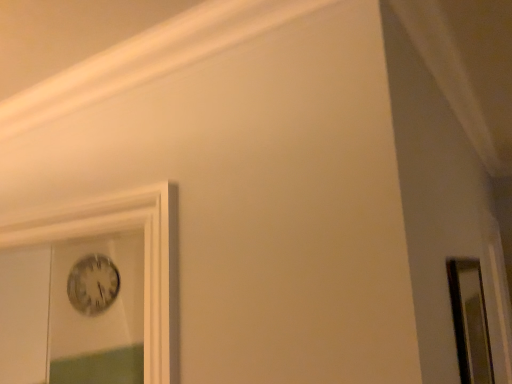
Question: From the image's perspective, relative to metallic silver clock at upper left, is clear glass mirror at right above or below?

Choices:
 (A) below
 (B) above

Answer: (B)

Question: Is clear glass mirror at right inside or outside of metallic silver clock at upper left?

Choices:
 (A) inside
 (B) outside

Answer: (B)

Question: In the image, is clear glass mirror at right positioned in front of or behind metallic silver clock at upper left?

Choices:
 (A) front
 (B) behind

Answer: (A)

Question: Considering the relative positions of metallic silver clock at upper left and clear glass mirror at right in the image provided, is metallic silver clock at upper left to the left or to the right of clear glass mirror at right?

Choices:
 (A) left
 (B) right

Answer: (A)

Question: Considering the positions of metallic silver clock at upper left and clear glass mirror at right in the image, is metallic silver clock at upper left wider or thinner than clear glass mirror at right?

Choices:
 (A) wide
 (B) thin

Answer: (B)

Question: From the image's perspective, is metallic silver clock at upper left located above or below clear glass mirror at right?

Choices:
 (A) above
 (B) below

Answer: (B)

Question: Is point (94, 259) closer or farther from the camera than point (489, 354)?

Choices:
 (A) farther
 (B) closer

Answer: (A)